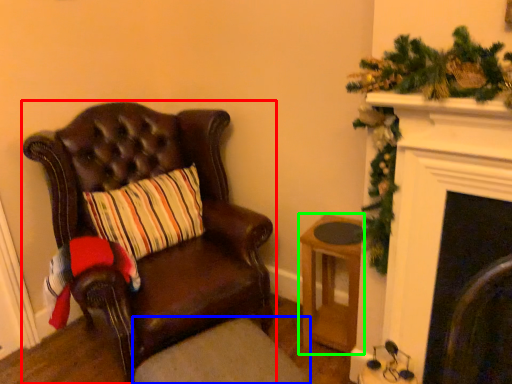
Question: Which is nearer to the chair (highlighted by a red box)? footrest (highlighted by a blue box) or stool (highlighted by a green box).

Choices:
 (A) footrest
 (B) stool

Answer: (A)